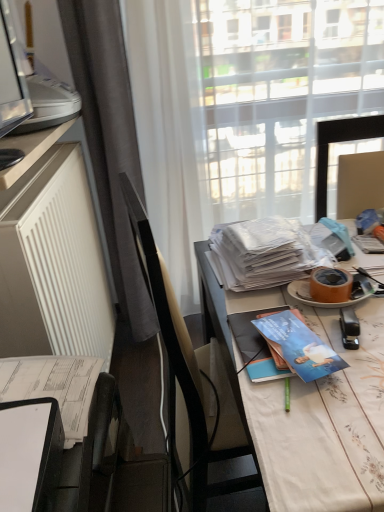
The width and height of the screenshot is (384, 512). What are the coordinates of `unoccupied region to the right of blue glossy book at center` in the screenshot? It's located at coord(352,341).